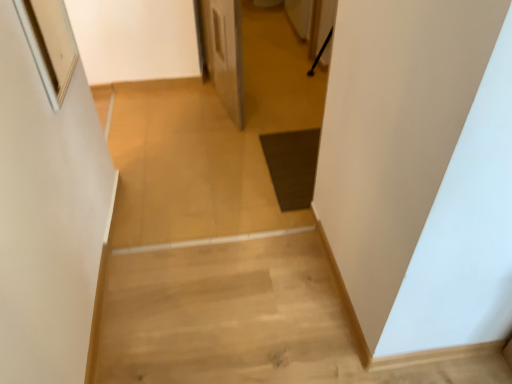
What do you see at coordinates (224, 53) in the screenshot? The width and height of the screenshot is (512, 384). I see `wooden door at center` at bounding box center [224, 53].

You are a GUI agent. You are given a task and a screenshot of the screen. Output one action in this format:
    pyautogui.click(x=<x>, y=<y>)
    Task: Click on the wooden door at center
    The height and width of the screenshot is (384, 512).
    Given the screenshot: What is the action you would take?
    pyautogui.click(x=224, y=53)

Measure the distance between wooden door at center and camera.

A distance of 6.61 feet exists between wooden door at center and camera.

At what (x,y) coordinates should I click in order to perform the action: click on wooden door at center. Please return your answer as a coordinate pair (x, y). Looking at the image, I should click on (224, 53).